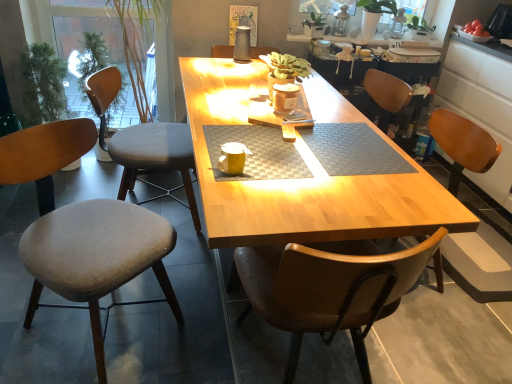
Identify the location of wooden chair at right, the 3th chair in the left-to-right sequence. (480, 264).

Find the location of a particular element. Image resolution: width=512 pixels, height=384 pixels. velvet grey chair at left, the 1th chair in the left-to-right sequence is located at coordinates (96, 257).

What do you see at coordinates (96, 257) in the screenshot? The height and width of the screenshot is (384, 512). I see `velvet grey chair at left, the 1th chair in the left-to-right sequence` at bounding box center [96, 257].

What is the approximate width of gray fabric chair at left, the second chair positioned from the left?

23.23 inches.

At what (x,y) coordinates should I click in order to perform the action: click on green matte plant at upper right. Please return your answer as a coordinate pair (x, y). The width and height of the screenshot is (512, 384). Looking at the image, I should click on (374, 15).

Describe the element at coordinates (301, 181) in the screenshot. I see `wooden table at center` at that location.

You are a GUI agent. You are given a task and a screenshot of the screen. Output one action in this format:
    pyautogui.click(x=<x>, y=<y>)
    Task: Click on the wooden chair at right, which ranks as the 1th chair in right-to-left order
    The width and height of the screenshot is (512, 384).
    Given the screenshot: What is the action you would take?
    pyautogui.click(x=480, y=264)

Which object is closer to the camera, wooden table at center or velvet grey chair at left, positioned as the third chair in right-to-left order?

Positioned in front is wooden table at center.

Could you tell me if wooden table at center is facing velvet grey chair at left, the 1th chair in the left-to-right sequence?

No.

Can you confirm if wooden table at center is positioned to the left of velvet grey chair at left, the 1th chair in the left-to-right sequence?

Incorrect, wooden table at center is not on the left side of velvet grey chair at left, the 1th chair in the left-to-right sequence.

Is wooden table at center smaller than velvet grey chair at left, positioned as the third chair in right-to-left order?

No, wooden table at center is not smaller than velvet grey chair at left, positioned as the third chair in right-to-left order.

The width and height of the screenshot is (512, 384). Identify the location of chair above the velvet grey chair at left, positioned as the third chair in right-to-left order (from a real-world perspective). (480, 264).

Considering the sizes of wooden chair at right, the 3th chair in the left-to-right sequence, and velvet grey chair at left, the 1th chair in the left-to-right sequence, in the image, is wooden chair at right, the 3th chair in the left-to-right sequence, wider or thinner than velvet grey chair at left, the 1th chair in the left-to-right sequence,?

wooden chair at right, the 3th chair in the left-to-right sequence, is wider than velvet grey chair at left, the 1th chair in the left-to-right sequence.

Considering the positions of objects wooden chair at right, the 3th chair in the left-to-right sequence, and velvet grey chair at left, the 1th chair in the left-to-right sequence, in the image provided, who is more to the right, wooden chair at right, the 3th chair in the left-to-right sequence, or velvet grey chair at left, the 1th chair in the left-to-right sequence,?

Positioned to the right is wooden chair at right, the 3th chair in the left-to-right sequence.

From the image's perspective, is wooden chair at right, which ranks as the 1th chair in right-to-left order, above velvet grey chair at left, the 1th chair in the left-to-right sequence?

Yes, from the image's perspective, wooden chair at right, which ranks as the 1th chair in right-to-left order, is on top of velvet grey chair at left, the 1th chair in the left-to-right sequence.

Looking at this image, from the image's perspective, would you say yellow matte coffee cup at center is shown under velvet grey chair at left, positioned as the third chair in right-to-left order?

No, from the image's perspective, yellow matte coffee cup at center is not below velvet grey chair at left, positioned as the third chair in right-to-left order.

Is yellow matte coffee cup at center not within velvet grey chair at left, the 1th chair in the left-to-right sequence?

Yes, yellow matte coffee cup at center is outside of velvet grey chair at left, the 1th chair in the left-to-right sequence.

Does yellow matte coffee cup at center have a smaller size compared to velvet grey chair at left, positioned as the third chair in right-to-left order?

Indeed, yellow matte coffee cup at center has a smaller size compared to velvet grey chair at left, positioned as the third chair in right-to-left order.

Locate an element on the screen. The height and width of the screenshot is (384, 512). coffee cup above the velvet grey chair at left, the 1th chair in the left-to-right sequence (from a real-world perspective) is located at coordinates (233, 158).

Is velvet grey chair at left, the 1th chair in the left-to-right sequence, touching wooden chair at right, the 3th chair in the left-to-right sequence?

No, velvet grey chair at left, the 1th chair in the left-to-right sequence, is not making contact with wooden chair at right, the 3th chair in the left-to-right sequence.

From the image's perspective, between velvet grey chair at left, positioned as the third chair in right-to-left order, and wooden chair at right, which ranks as the 1th chair in right-to-left order, which one is located above?

wooden chair at right, which ranks as the 1th chair in right-to-left order, is shown above in the image.

Locate an element on the screen. The height and width of the screenshot is (384, 512). the 1st chair located beneath the wooden chair at right, which ranks as the 1th chair in right-to-left order (from a real-world perspective) is located at coordinates (96, 257).

Based on the photo, is velvet grey chair at left, the 1th chair in the left-to-right sequence, in front of wooden chair at right, the 3th chair in the left-to-right sequence?

That is True.

Is wooden chair at right, the 3th chair in the left-to-right sequence, located outside yellow matte coffee cup at center?

Yes, wooden chair at right, the 3th chair in the left-to-right sequence, is not within yellow matte coffee cup at center.

Does wooden chair at right, the 3th chair in the left-to-right sequence, have a larger size compared to yellow matte coffee cup at center?

Indeed, wooden chair at right, the 3th chair in the left-to-right sequence, has a larger size compared to yellow matte coffee cup at center.

Can you confirm if wooden chair at right, the 3th chair in the left-to-right sequence, is thinner than yellow matte coffee cup at center?

No.

Is green matte plant at upper right spatially inside gray fabric chair at left, arranged as the 2th chair when viewed from the right, or outside of it?

green matte plant at upper right is spatially situated outside gray fabric chair at left, arranged as the 2th chair when viewed from the right.

Looking at this image, is green matte plant at upper right wider than gray fabric chair at left, the second chair positioned from the left?

In fact, green matte plant at upper right might be narrower than gray fabric chair at left, the second chair positioned from the left.

Is green matte plant at upper right positioned far away from gray fabric chair at left, arranged as the 2th chair when viewed from the right?

Yes, green matte plant at upper right and gray fabric chair at left, arranged as the 2th chair when viewed from the right, are quite far apart.

From the image's perspective, would you say green matte plant at upper right is positioned over gray fabric chair at left, arranged as the 2th chair when viewed from the right?

Yes, from the image's perspective, green matte plant at upper right is on top of gray fabric chair at left, arranged as the 2th chair when viewed from the right.

Consider the image. From their relative heights in the image, would you say green matte plant at upper right is taller or shorter than yellow matte coffee cup at center?

green matte plant at upper right is taller than yellow matte coffee cup at center.

Can we say green matte plant at upper right lies outside yellow matte coffee cup at center?

That's correct, green matte plant at upper right is outside of yellow matte coffee cup at center.

From a real-world perspective, which is physically below, green matte plant at upper right or yellow matte coffee cup at center?

In real-world perspective, yellow matte coffee cup at center is lower.

Can you tell me how much green matte plant at upper right and yellow matte coffee cup at center differ in facing direction?

177 degrees.

Image resolution: width=512 pixels, height=384 pixels. I want to click on the 2nd chair to the left when counting from the wooden table at center, so click(x=96, y=257).

Find the location of `chair that is in front of the wooden chair at right, the 3th chair in the left-to-right sequence`. chair that is in front of the wooden chair at right, the 3th chair in the left-to-right sequence is located at coordinates (96, 257).

Considering their positions, is wooden chair at right, which ranks as the 1th chair in right-to-left order, positioned closer to yellow matte coffee cup at center than gray fabric chair at left, the second chair positioned from the left?

gray fabric chair at left, the second chair positioned from the left, is closer to yellow matte coffee cup at center.

Looking at the image, which one is located further to wooden table at center, wooden chair at right, which ranks as the 1th chair in right-to-left order, or gray fabric chair at left, arranged as the 2th chair when viewed from the right?

wooden chair at right, which ranks as the 1th chair in right-to-left order.

Estimate the real-world distances between objects in this image. Which object is closer to yellow matte coffee cup at center, velvet grey chair at left, positioned as the third chair in right-to-left order, or wooden chair at right, the 3th chair in the left-to-right sequence?

Based on the image, velvet grey chair at left, positioned as the third chair in right-to-left order, appears to be nearer to yellow matte coffee cup at center.

When comparing their distances from green matte plant at upper right, does yellow matte coffee cup at center or gray fabric chair at left, the second chair positioned from the left, seem further?

Based on the image, yellow matte coffee cup at center appears to be further to green matte plant at upper right.

From the image, which object appears to be farther from wooden chair at right, the 3th chair in the left-to-right sequence, velvet grey chair at left, positioned as the third chair in right-to-left order, or green matte plant at upper right?

velvet grey chair at left, positioned as the third chair in right-to-left order, is positioned further to the anchor wooden chair at right, the 3th chair in the left-to-right sequence.

When comparing their distances from gray fabric chair at left, arranged as the 2th chair when viewed from the right, does wooden table at center or green matte plant at upper right seem further?

Based on the image, green matte plant at upper right appears to be further to gray fabric chair at left, arranged as the 2th chair when viewed from the right.

Which object lies further to the anchor point green matte plant at upper right, wooden table at center or wooden chair at right, which ranks as the 1th chair in right-to-left order?

wooden table at center is further to green matte plant at upper right.

Which object lies further to the anchor point wooden chair at right, the 3th chair in the left-to-right sequence, gray fabric chair at left, the second chair positioned from the left, or yellow matte coffee cup at center?

gray fabric chair at left, the second chair positioned from the left, lies further to wooden chair at right, the 3th chair in the left-to-right sequence, than the other object.

At what (x,y) coordinates should I click in order to perform the action: click on desk between gray fabric chair at left, arranged as the 2th chair when viewed from the right, and wooden chair at right, which ranks as the 1th chair in right-to-left order. Please return your answer as a coordinate pair (x, y). The image size is (512, 384). Looking at the image, I should click on (301, 181).

Find the location of `coffee cup situated between velvet grey chair at left, positioned as the third chair in right-to-left order, and wooden table at center from left to right`. coffee cup situated between velvet grey chair at left, positioned as the third chair in right-to-left order, and wooden table at center from left to right is located at coordinates (233, 158).

Find the location of a particular element. This screenshot has height=384, width=512. chair between gray fabric chair at left, arranged as the 2th chair when viewed from the right, and green matte plant at upper right is located at coordinates (480, 264).

What are the coordinates of `coffee cup positioned between wooden table at center and gray fabric chair at left, the second chair positioned from the left, from near to far` in the screenshot? It's located at (233, 158).